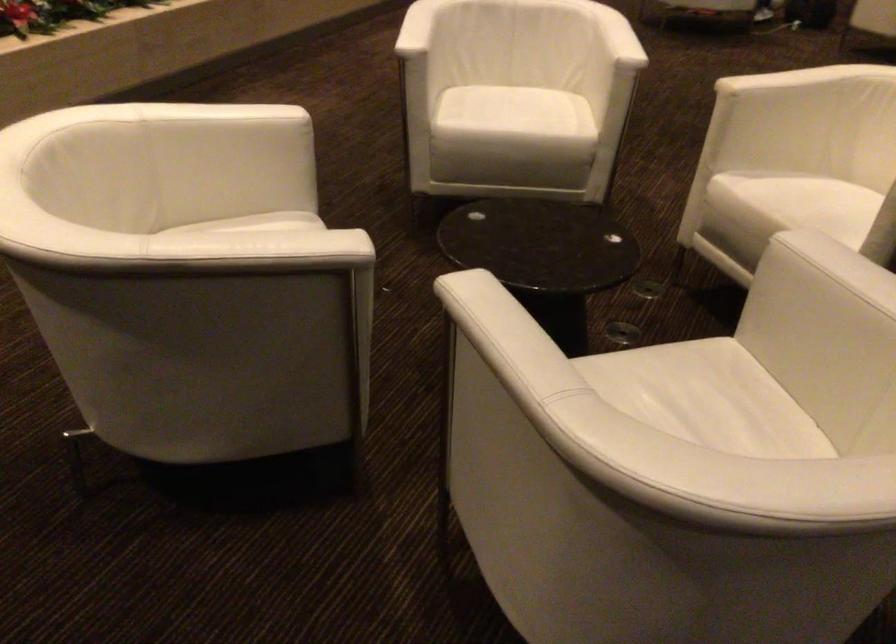
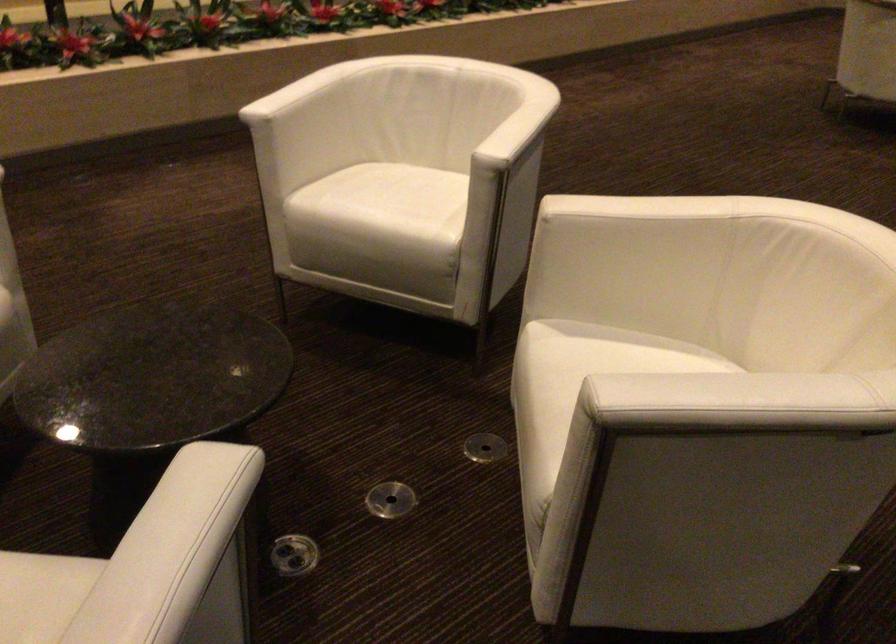
The point at (x=538, y=247) is marked in the first image. Where is the corresponding point in the second image?

(152, 377)